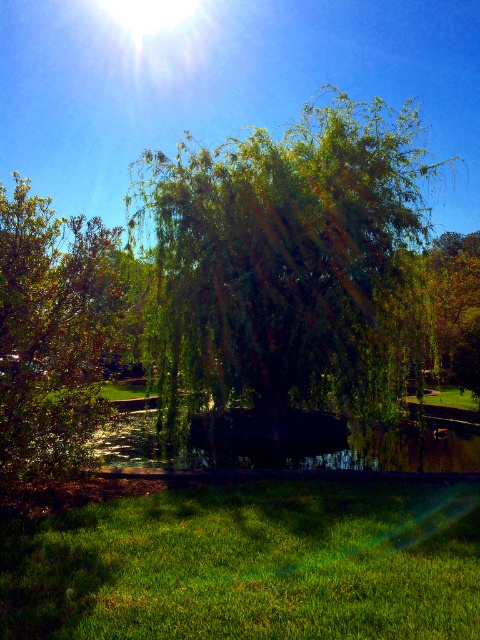
Question: Is green leafy willow at center positioned before green leafy tree at center?

Choices:
 (A) yes
 (B) no

Answer: (A)

Question: Which is farther from the green grassy at lower center?

Choices:
 (A) green leafy tree at left
 (B) green leafy willow at center

Answer: (B)

Question: In this image, where is green leafy tree at left located relative to green leafy tree at center?

Choices:
 (A) below
 (B) above

Answer: (B)

Question: Which object is closer to the camera taking this photo?

Choices:
 (A) green leafy tree at center
 (B) green leafy tree at left

Answer: (B)

Question: Does green grassy at lower center appear under green leafy tree at left?

Choices:
 (A) no
 (B) yes

Answer: (B)

Question: Which point is farther to the camera?

Choices:
 (A) (472, 244)
 (B) (170, 576)
 (C) (197, 225)
 (D) (19, 385)

Answer: (A)